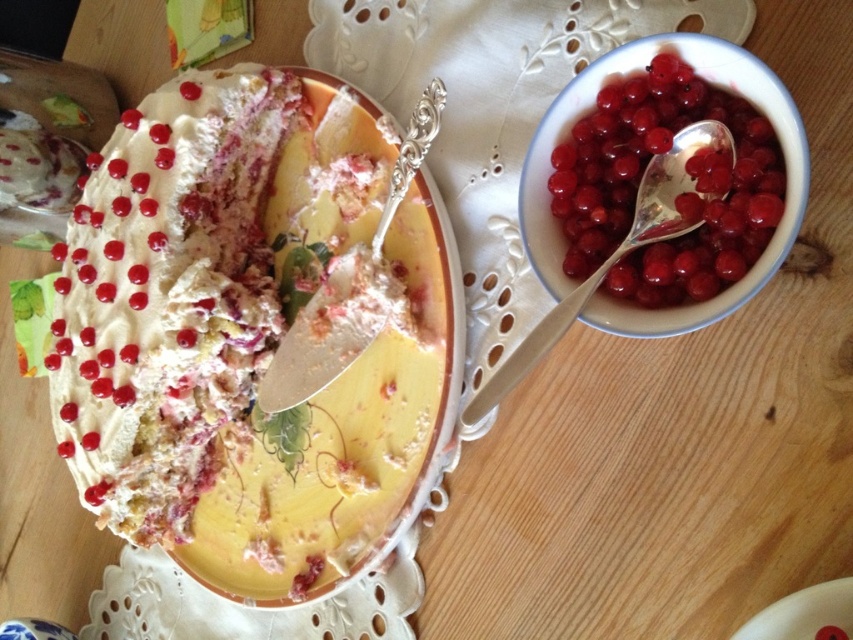
Is porcelain bowl filled with red berries at upper right behind silver metallic spoon at upper right?

No.

Is porcelain bowl filled with red berries at upper right smaller than silver metallic spoon at upper right?

Actually, porcelain bowl filled with red berries at upper right might be larger than silver metallic spoon at upper right.

This screenshot has height=640, width=853. I want to click on porcelain bowl filled with red berries at upper right, so tap(590, 108).

Is white creamy cake at center shorter than matte white cake at upper left?

In fact, white creamy cake at center may be taller than matte white cake at upper left.

Between white creamy cake at center and matte white cake at upper left, which one has more height?

With more height is white creamy cake at center.

Is point (149, 412) closer to viewer compared to point (44, 184)?

Yes, point (149, 412) is closer to viewer.

Where is `white creamy cake at center`? The height and width of the screenshot is (640, 853). white creamy cake at center is located at coordinates (250, 332).

Consider the image. Is matte white cake at upper left above silver metallic spoon at upper right?

Yes.

Looking at this image, who is more distant from viewer, (1, 122) or (560, 317)?

The point (1, 122) is more distant.

This screenshot has width=853, height=640. Describe the element at coordinates (45, 141) in the screenshot. I see `matte white cake at upper left` at that location.

Locate an element on the screen. matte white cake at upper left is located at coordinates [x=45, y=141].